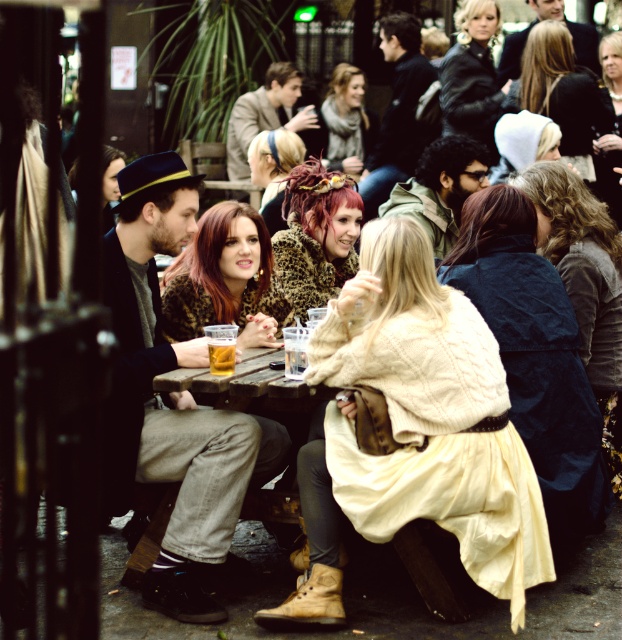
From the picture: Which is above, leopard print hairband at center or translucent glass cup at center?

Positioned higher is leopard print hairband at center.

Does leopard print hairband at center appear on the left side of translucent glass cup at center?

No, leopard print hairband at center is not to the left of translucent glass cup at center.

Between point (302, 275) and point (223, 362), which one is positioned in front?

Positioned in front is point (223, 362).

Where is `leopard print hairband at center`? The image size is (622, 640). leopard print hairband at center is located at coordinates (317, 236).

Who is positioned more to the left, black leather jacket at upper center or translucent glass cup at center?

translucent glass cup at center is more to the left.

Between black leather jacket at upper center and translucent glass cup at center, which one appears on the right side from the viewer's perspective?

black leather jacket at upper center is more to the right.

The height and width of the screenshot is (640, 622). Describe the element at coordinates (473, 77) in the screenshot. I see `black leather jacket at upper center` at that location.

Locate an element on the screen. black leather jacket at upper center is located at coordinates (473, 77).

Is point (488, 520) more distant than point (253, 480)?

No, it is in front of (253, 480).

Who is positioned more to the left, white knitted sweater at center or wooden table at center?

Positioned to the left is wooden table at center.

Where is `white knitted sweater at center`? white knitted sweater at center is located at coordinates coord(415,432).